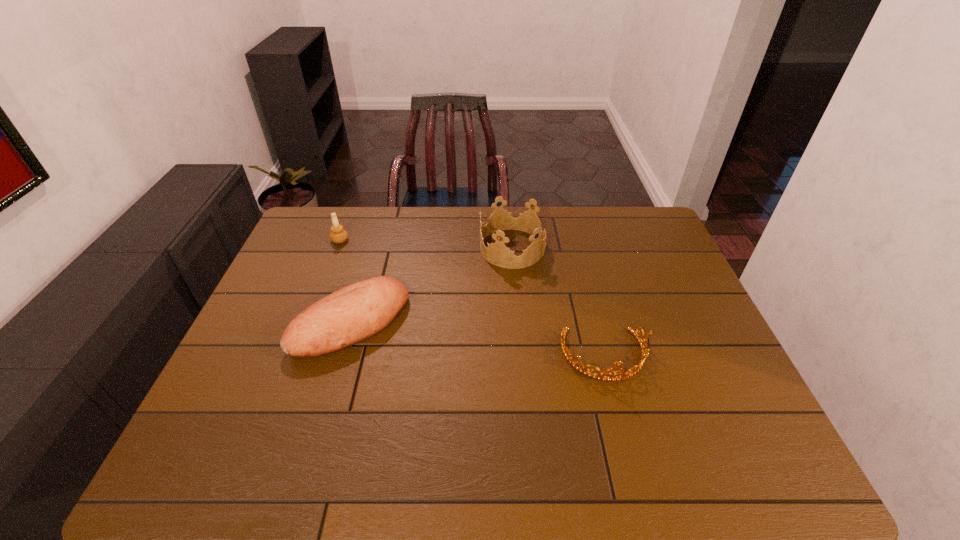
Where is `the farther tiara`? the farther tiara is located at coordinates (497, 253).

Where is `the taller tiara`? This screenshot has height=540, width=960. the taller tiara is located at coordinates (497, 253).

You are a GUI agent. You are given a task and a screenshot of the screen. Output one action in this format:
    pyautogui.click(x=<x>, y=<y>)
    Task: Click on the candle_holder
    
    Given the screenshot: What is the action you would take?
    pyautogui.click(x=338, y=235)

At what (x,y) coordinates should I click in order to perform the action: click on bread. Please return your answer as a coordinate pair (x, y). Looking at the image, I should click on (354, 313).

Identify the location of the shorter tiara. Image resolution: width=960 pixels, height=540 pixels. (633, 370).

At what (x,y) coordinates should I click in order to perform the action: click on vacant region located 0.140m on the front-facing side of the taller tiara. Please return your answer as a coordinate pair (x, y). Looking at the image, I should click on (438, 248).

This screenshot has width=960, height=540. In order to click on blank space located on the front-facing side of the taller tiara in this screenshot , I will do `click(363, 248)`.

You are a GUI agent. You are given a task and a screenshot of the screen. Output one action in this format:
    pyautogui.click(x=<x>, y=<y>)
    Task: Click on the free space located 0.260m on the front-facing side of the taller tiara
    The width and height of the screenshot is (960, 540).
    Given the screenshot: What is the action you would take?
    pyautogui.click(x=402, y=248)

Where is `vacant space located 0.210m on the front of the candle_holder`? This screenshot has height=540, width=960. vacant space located 0.210m on the front of the candle_holder is located at coordinates [322, 289].

What are the coordinates of `vacant space located on the left of the bread` in the screenshot? It's located at (269, 322).